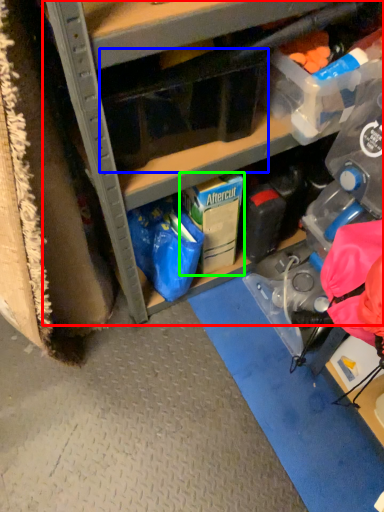
Question: Which object is the closest to the cabinetry (highlighted by a red box)? Choose among these: storage box (highlighted by a blue box) or storage box (highlighted by a green box).

Choices:
 (A) storage box
 (B) storage box

Answer: (A)